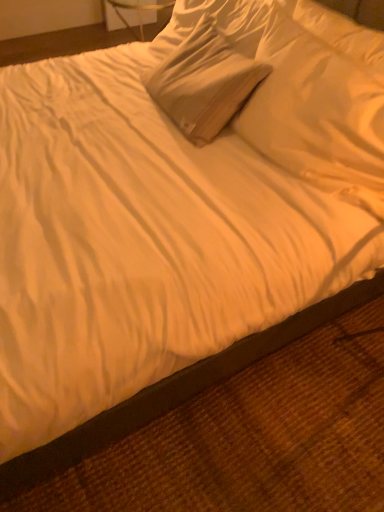
In order to face white soft pillow at upper center, marked as the first pillow in a left-to-right arrangement, should I rotate leftwards or rightwards?

You should look right and rotate roughly 2.921 degrees.

Find the location of `white soft pillow at upper center, the second pillow in the right-to-left sequence`. white soft pillow at upper center, the second pillow in the right-to-left sequence is located at coordinates (204, 82).

Measure the distance between white soft pillow at upper center, the second pillow in the right-to-left sequence, and camera.

They are 1.28 meters apart.

The height and width of the screenshot is (512, 384). What do you see at coordinates (204, 82) in the screenshot?
I see `white soft pillow at upper center, marked as the first pillow in a left-to-right arrangement` at bounding box center [204, 82].

The image size is (384, 512). In order to click on white soft pillow at upper center, positioned as the 1th pillow in right-to-left order in this screenshot , I will do `click(316, 110)`.

Image resolution: width=384 pixels, height=512 pixels. Describe the element at coordinates (316, 110) in the screenshot. I see `white soft pillow at upper center, the 2th pillow viewed from the left` at that location.

How much space does white soft pillow at upper center, positioned as the 1th pillow in right-to-left order, occupy vertically?

The height of white soft pillow at upper center, positioned as the 1th pillow in right-to-left order, is 12.04 inches.

You are a GUI agent. You are given a task and a screenshot of the screen. Output one action in this format:
    pyautogui.click(x=<x>, y=<y>)
    Task: Click on the white soft pillow at upper center, marked as the first pillow in a left-to-right arrangement
    The image size is (384, 512).
    Given the screenshot: What is the action you would take?
    pyautogui.click(x=204, y=82)

Between white soft pillow at upper center, the second pillow in the right-to-left sequence, and white soft pillow at upper center, the 2th pillow viewed from the left, which one appears on the right side from the viewer's perspective?

From the viewer's perspective, white soft pillow at upper center, the 2th pillow viewed from the left, appears more on the right side.

Consider the image. Which is behind, white soft pillow at upper center, the second pillow in the right-to-left sequence, or white soft pillow at upper center, positioned as the 1th pillow in right-to-left order?

white soft pillow at upper center, the second pillow in the right-to-left sequence, is further from the camera.

Considering the positions of points (226, 76) and (279, 142), is point (226, 76) farther from camera compared to point (279, 142)?

Yes, point (226, 76) is farther from viewer.

From the image's perspective, is white soft pillow at upper center, the second pillow in the right-to-left sequence, over white soft pillow at upper center, the 2th pillow viewed from the left?

Yes, from the image's perspective, white soft pillow at upper center, the second pillow in the right-to-left sequence, is on top of white soft pillow at upper center, the 2th pillow viewed from the left.

From a real-world perspective, relative to white soft pillow at upper center, the 2th pillow viewed from the left, is white soft pillow at upper center, marked as the first pillow in a left-to-right arrangement, vertically above or below?

In terms of real-world spatial position, white soft pillow at upper center, marked as the first pillow in a left-to-right arrangement, is below white soft pillow at upper center, the 2th pillow viewed from the left.

Is white soft pillow at upper center, the second pillow in the right-to-left sequence, thinner than white soft pillow at upper center, positioned as the 1th pillow in right-to-left order?

No.

From their relative heights in the image, would you say white soft pillow at upper center, the second pillow in the right-to-left sequence, is taller or shorter than white soft pillow at upper center, the 2th pillow viewed from the left?

In the image, white soft pillow at upper center, the second pillow in the right-to-left sequence, appears to be taller than white soft pillow at upper center, the 2th pillow viewed from the left.

Which of these two, white soft pillow at upper center, marked as the first pillow in a left-to-right arrangement, or white soft pillow at upper center, the 2th pillow viewed from the left, is bigger?

With larger size is white soft pillow at upper center, marked as the first pillow in a left-to-right arrangement.

Would you say white soft pillow at upper center, marked as the first pillow in a left-to-right arrangement, is inside or outside white soft pillow at upper center, positioned as the 1th pillow in right-to-left order?

white soft pillow at upper center, marked as the first pillow in a left-to-right arrangement, is not enclosed by white soft pillow at upper center, positioned as the 1th pillow in right-to-left order.

Is white soft pillow at upper center, marked as the first pillow in a left-to-right arrangement, touching white soft pillow at upper center, the 2th pillow viewed from the left?

No, white soft pillow at upper center, marked as the first pillow in a left-to-right arrangement, is not making contact with white soft pillow at upper center, the 2th pillow viewed from the left.

Is white soft pillow at upper center, the second pillow in the right-to-left sequence, turned away from white soft pillow at upper center, positioned as the 1th pillow in right-to-left order?

white soft pillow at upper center, the second pillow in the right-to-left sequence, does not have its back to white soft pillow at upper center, positioned as the 1th pillow in right-to-left order.

How different are the orientations of white soft pillow at upper center, marked as the first pillow in a left-to-right arrangement, and white soft pillow at upper center, positioned as the 1th pillow in right-to-left order, in degrees?

9.13 degrees.

Identify the location of pillow on the left of the white soft pillow at upper center, positioned as the 1th pillow in right-to-left order. The height and width of the screenshot is (512, 384). (204, 82).

Which is more to the right, white soft pillow at upper center, the 2th pillow viewed from the left, or white soft pillow at upper center, the second pillow in the right-to-left sequence?

Positioned to the right is white soft pillow at upper center, the 2th pillow viewed from the left.

Is the position of white soft pillow at upper center, positioned as the 1th pillow in right-to-left order, less distant than that of white soft pillow at upper center, marked as the first pillow in a left-to-right arrangement?

Yes, white soft pillow at upper center, positioned as the 1th pillow in right-to-left order, is closer to the viewer.

Which is behind, point (304, 158) or point (173, 100)?

The point (173, 100) is more distant.

From the image's perspective, is white soft pillow at upper center, the 2th pillow viewed from the left, above or below white soft pillow at upper center, marked as the first pillow in a left-to-right arrangement?

white soft pillow at upper center, the 2th pillow viewed from the left, is below white soft pillow at upper center, marked as the first pillow in a left-to-right arrangement.

Looking at this image, from a real-world perspective, which is physically below, white soft pillow at upper center, positioned as the 1th pillow in right-to-left order, or white soft pillow at upper center, the second pillow in the right-to-left sequence?

white soft pillow at upper center, the second pillow in the right-to-left sequence, from a real-world perspective.

Which object is thinner, white soft pillow at upper center, the 2th pillow viewed from the left, or white soft pillow at upper center, marked as the first pillow in a left-to-right arrangement?

With smaller width is white soft pillow at upper center, the 2th pillow viewed from the left.

Considering the relative sizes of white soft pillow at upper center, positioned as the 1th pillow in right-to-left order, and white soft pillow at upper center, the second pillow in the right-to-left sequence, in the image provided, is white soft pillow at upper center, positioned as the 1th pillow in right-to-left order, taller than white soft pillow at upper center, the second pillow in the right-to-left sequence,?

No.

Looking at the image, does white soft pillow at upper center, the 2th pillow viewed from the left, seem bigger or smaller compared to white soft pillow at upper center, the second pillow in the right-to-left sequence?

white soft pillow at upper center, the 2th pillow viewed from the left, is smaller than white soft pillow at upper center, the second pillow in the right-to-left sequence.

Based on the photo, is white soft pillow at upper center, the 2th pillow viewed from the left, inside the boundaries of white soft pillow at upper center, the second pillow in the right-to-left sequence, or outside?

white soft pillow at upper center, the 2th pillow viewed from the left, is not enclosed by white soft pillow at upper center, the second pillow in the right-to-left sequence.

Is the surface of white soft pillow at upper center, the 2th pillow viewed from the left, in direct contact with white soft pillow at upper center, the second pillow in the right-to-left sequence?

No, white soft pillow at upper center, the 2th pillow viewed from the left, is not touching white soft pillow at upper center, the second pillow in the right-to-left sequence.

Is white soft pillow at upper center, the second pillow in the right-to-left sequence, at the back of white soft pillow at upper center, the 2th pillow viewed from the left?

No, white soft pillow at upper center, the 2th pillow viewed from the left, is not facing away from white soft pillow at upper center, the second pillow in the right-to-left sequence.

How much distance is there between white soft pillow at upper center, the 2th pillow viewed from the left, and white soft pillow at upper center, the second pillow in the right-to-left sequence?

The distance of white soft pillow at upper center, the 2th pillow viewed from the left, from white soft pillow at upper center, the second pillow in the right-to-left sequence, is 7.94 inches.

At what (x,y) coordinates should I click in order to perform the action: click on pillow that is under the white soft pillow at upper center, positioned as the 1th pillow in right-to-left order (from a real-world perspective). Please return your answer as a coordinate pair (x, y). This screenshot has width=384, height=512. Looking at the image, I should click on click(x=204, y=82).

At what (x,y) coordinates should I click in order to perform the action: click on pillow on the left of white soft pillow at upper center, the 2th pillow viewed from the left. Please return your answer as a coordinate pair (x, y). This screenshot has width=384, height=512. Looking at the image, I should click on (204, 82).

The image size is (384, 512). What are the coordinates of `pillow above the white soft pillow at upper center, positioned as the 1th pillow in right-to-left order (from the image's perspective)` in the screenshot? It's located at (204, 82).